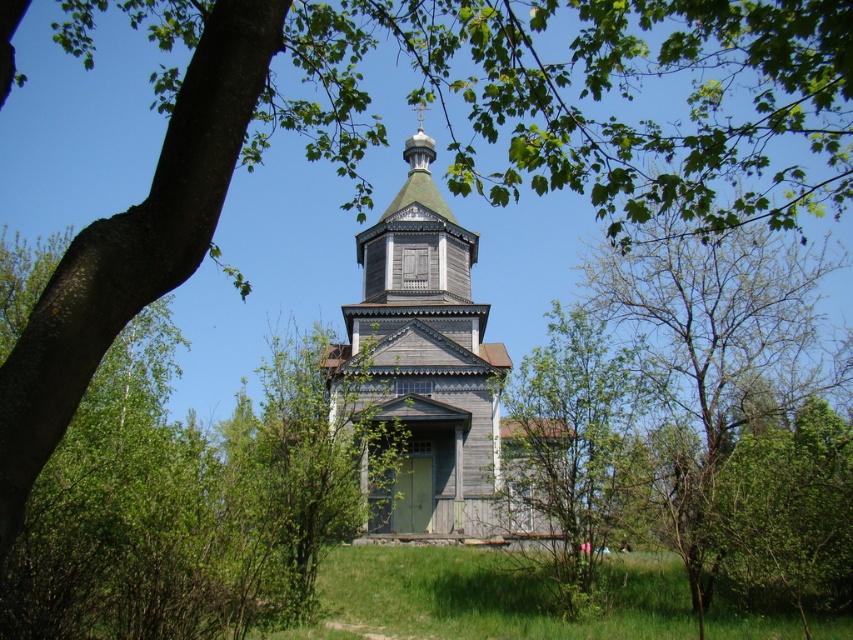
Image resolution: width=853 pixels, height=640 pixels. Describe the element at coordinates (428, 364) in the screenshot. I see `wooden church at center` at that location.

Does point (415, 429) come closer to viewer compared to point (549, 577)?

That is False.

I want to click on wooden church at center, so tap(428, 364).

Locate an element on the screen. Image resolution: width=853 pixels, height=640 pixels. wooden church at center is located at coordinates (428, 364).